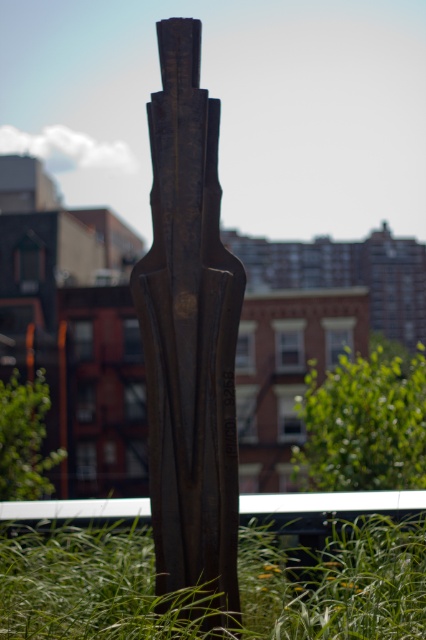
Question: Is green grass at center bigger than green grass at lower left?

Choices:
 (A) no
 (B) yes

Answer: (B)

Question: Is green grass at center wider than green leafy plant at center?

Choices:
 (A) yes
 (B) no

Answer: (B)

Question: Which point is farther to the camera?

Choices:
 (A) green grass at lower left
 (B) rusty metal sculpture at center
 (C) green leafy plant at center

Answer: (A)

Question: Among these points, which one is nearest to the camera?

Choices:
 (A) (394, 433)
 (B) (411, 586)
 (C) (189, 28)

Answer: (B)

Question: Estimate the real-world distances between objects in this image. Which object is closer to the green grass at lower left?

Choices:
 (A) green leafy plant at center
 (B) rusty metal sculpture at center
 (C) green grass at center

Answer: (A)

Question: Does green grass at center have a greater width compared to green leafy plant at center?

Choices:
 (A) yes
 (B) no

Answer: (B)